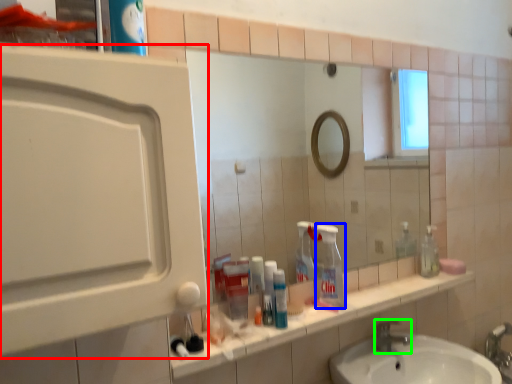
Question: Which object is positioned closest to medicine cabinet (highlighted by a red box)? Select from cleaning product (highlighted by a blue box) and tap (highlighted by a green box).

Choices:
 (A) cleaning product
 (B) tap

Answer: (A)